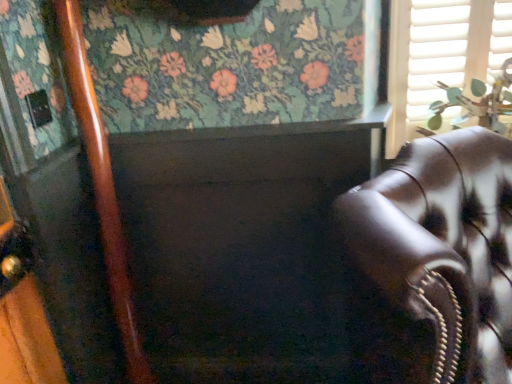
Question: Could you tell me if leather couch at right is facing green leafy plant at upper right?

Choices:
 (A) no
 (B) yes

Answer: (A)

Question: Can you confirm if leather couch at right is taller than green leafy plant at upper right?

Choices:
 (A) yes
 (B) no

Answer: (A)

Question: Is leather couch at right looking in the opposite direction of green leafy plant at upper right?

Choices:
 (A) yes
 (B) no

Answer: (A)

Question: From the image's perspective, does leather couch at right appear lower than green leafy plant at upper right?

Choices:
 (A) yes
 (B) no

Answer: (A)

Question: Can you confirm if leather couch at right is wider than green leafy plant at upper right?

Choices:
 (A) no
 (B) yes

Answer: (B)

Question: Can you confirm if leather couch at right is shorter than green leafy plant at upper right?

Choices:
 (A) no
 (B) yes

Answer: (A)

Question: Is green leafy plant at upper right outside white matte shutter at upper right?

Choices:
 (A) no
 (B) yes

Answer: (B)

Question: Can you confirm if green leafy plant at upper right is wider than white matte shutter at upper right?

Choices:
 (A) yes
 (B) no

Answer: (A)

Question: Is green leafy plant at upper right positioned with its back to white matte shutter at upper right?

Choices:
 (A) yes
 (B) no

Answer: (A)

Question: Can you confirm if green leafy plant at upper right is shorter than white matte shutter at upper right?

Choices:
 (A) no
 (B) yes

Answer: (B)

Question: From the image's perspective, is green leafy plant at upper right located beneath white matte shutter at upper right?

Choices:
 (A) yes
 (B) no

Answer: (A)

Question: Does green leafy plant at upper right have a larger size compared to white matte shutter at upper right?

Choices:
 (A) yes
 (B) no

Answer: (A)

Question: Can you confirm if white matte shutter at upper right is positioned to the left of green leafy plant at upper right?

Choices:
 (A) no
 (B) yes

Answer: (B)